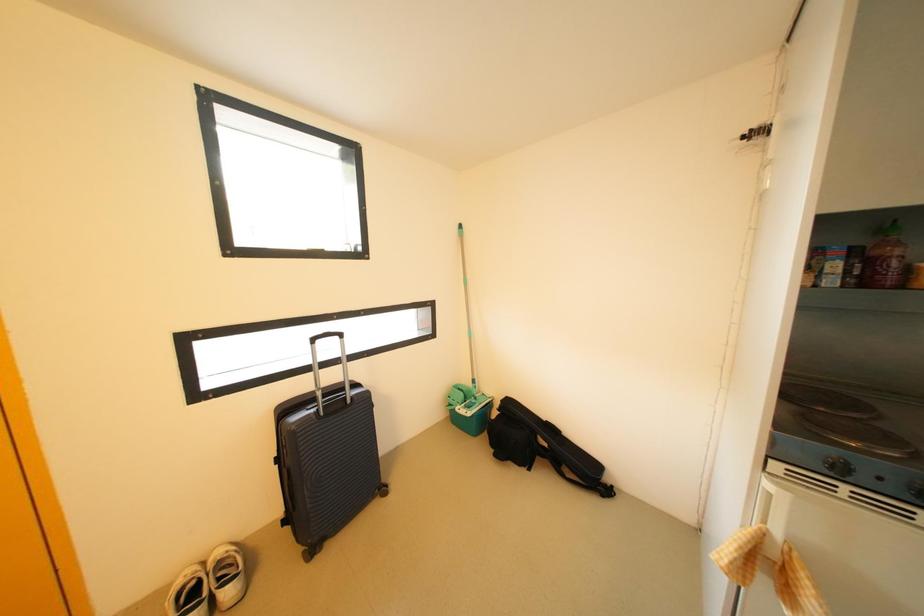
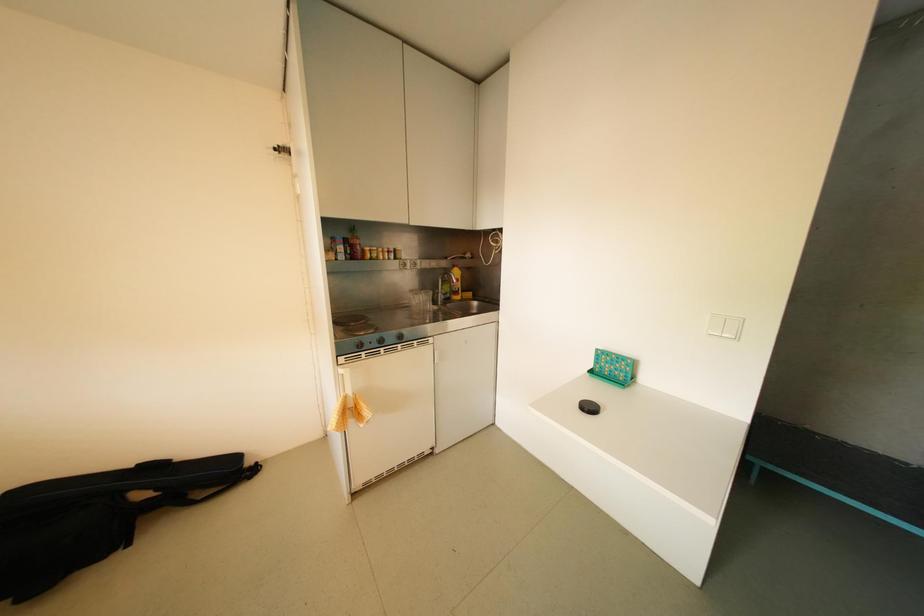
Question: The first image is from the beginning of the video and the second image is from the end. How did the camera likely rotate when shooting the video?

Choices:
 (A) Left
 (B) Right
 (C) Up
 (D) Down

Answer: (B)